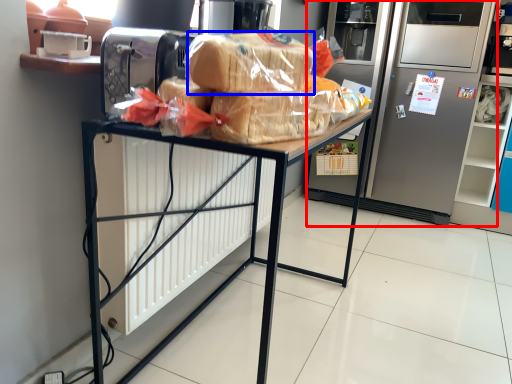
Question: Which object appears closest to the camera in this image, refrigerator (highlighted by a red box) or bread (highlighted by a blue box)?

Choices:
 (A) refrigerator
 (B) bread

Answer: (B)